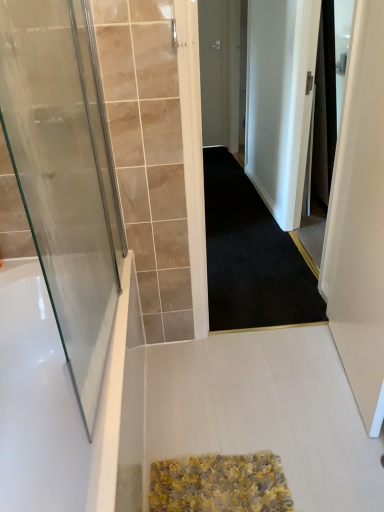
The image size is (384, 512). I want to click on vacant space to the left of white matte screen door at right, so click(x=270, y=386).